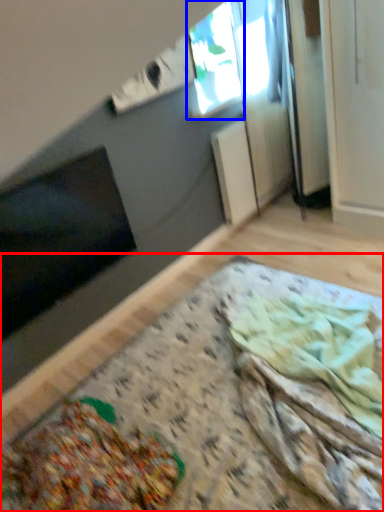
Question: Among these objects, which one is nearest to the camera, table (highlighted by a red box) or window (highlighted by a blue box)?

Choices:
 (A) table
 (B) window

Answer: (A)